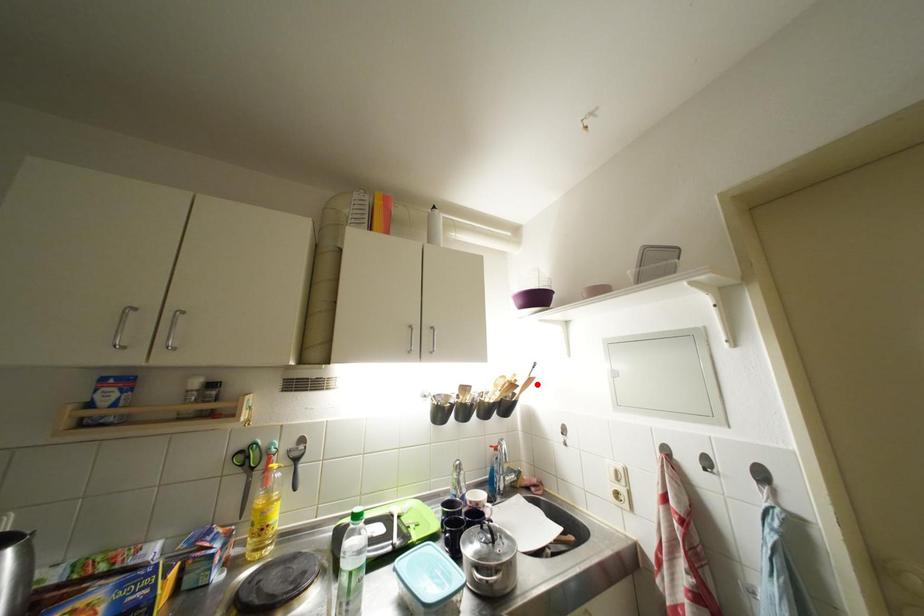
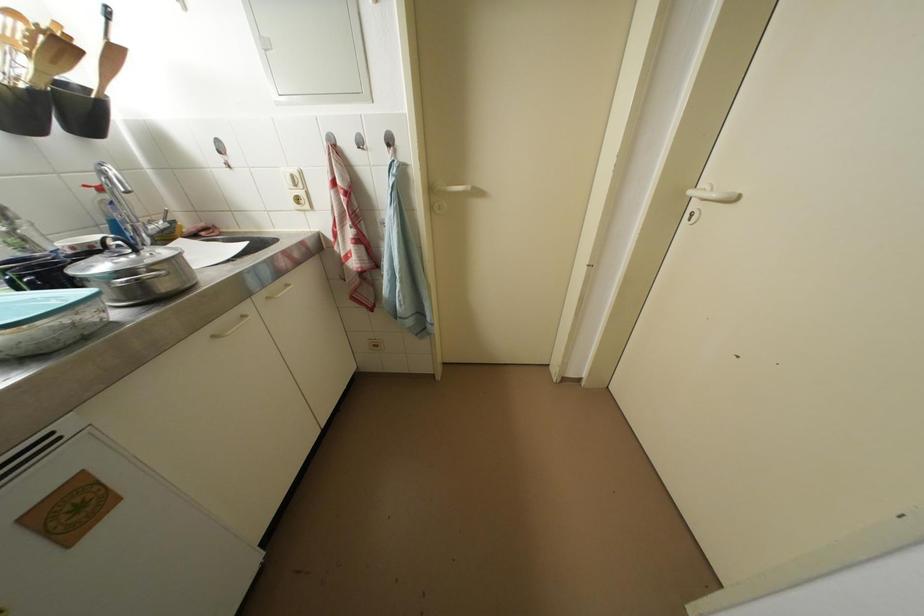
Where in the second image is the point corresponding to the highlighted location from the first image?

(120, 55)